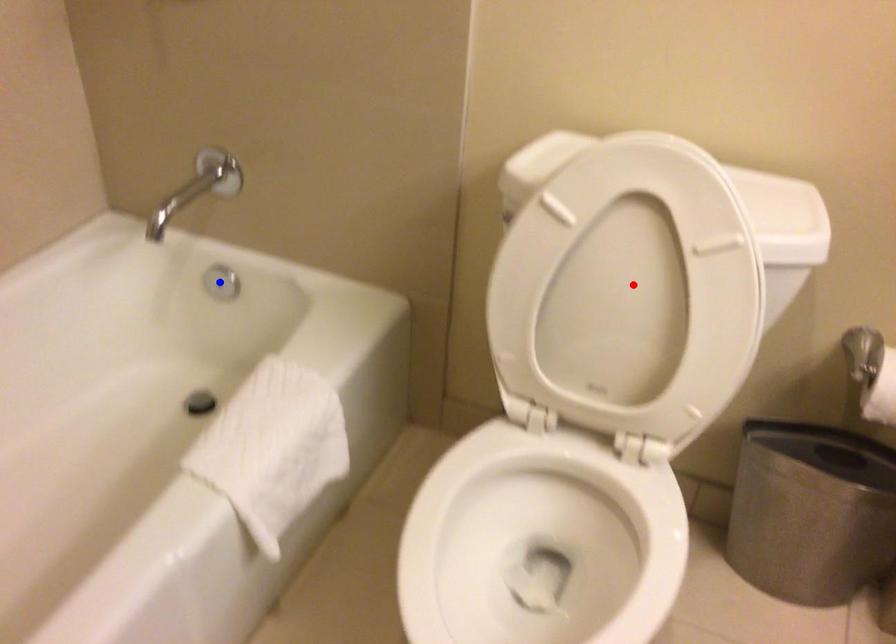
Question: In the image, two points are highlighted. Which point is nearer to the camera? Reply with the corresponding letter.

Choices:
 (A) blue point
 (B) red point

Answer: (B)